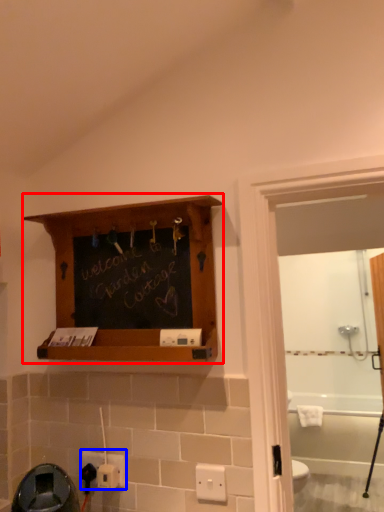
Question: Which of the following is the farthest to the observer, shelf (highlighted by a red box) or electric outlet (highlighted by a blue box)?

Choices:
 (A) shelf
 (B) electric outlet

Answer: (B)